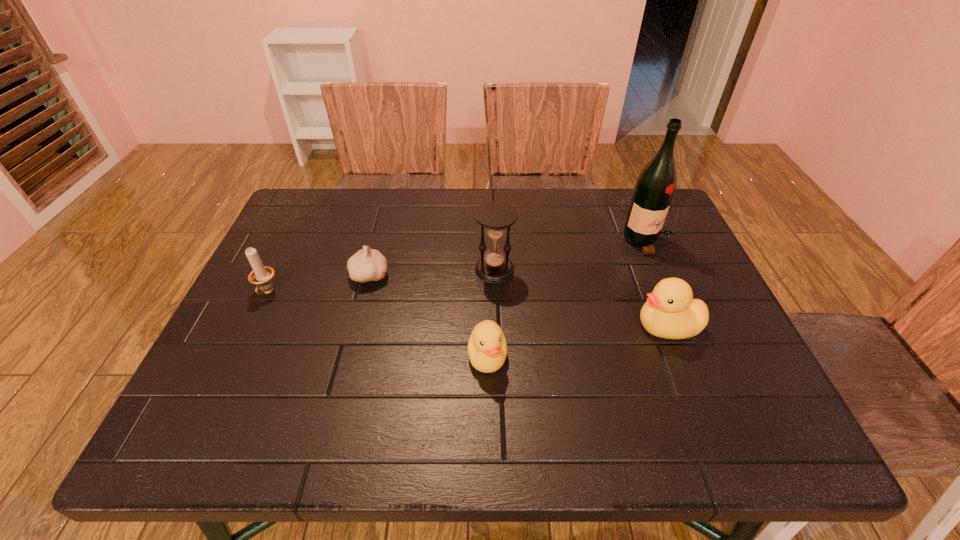
This screenshot has width=960, height=540. What are the coordinates of `vacant area that satisfies the following two spatial constraints: 1. at the beak of the right duck; 2. at the beak of the shorter duck` in the screenshot? It's located at (679, 356).